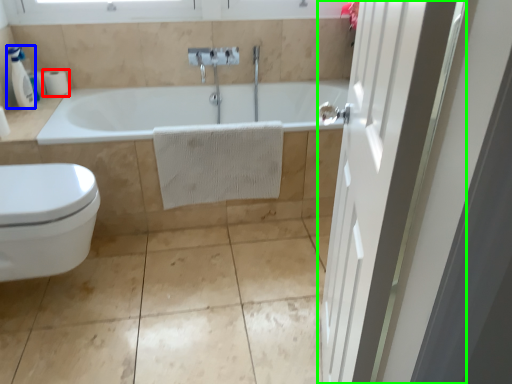
Question: Based on their relative distances, which object is farther from toilet paper (highlighted by a red box)? Choose from soap dispenser (highlighted by a blue box) and door (highlighted by a green box).

Choices:
 (A) soap dispenser
 (B) door

Answer: (B)